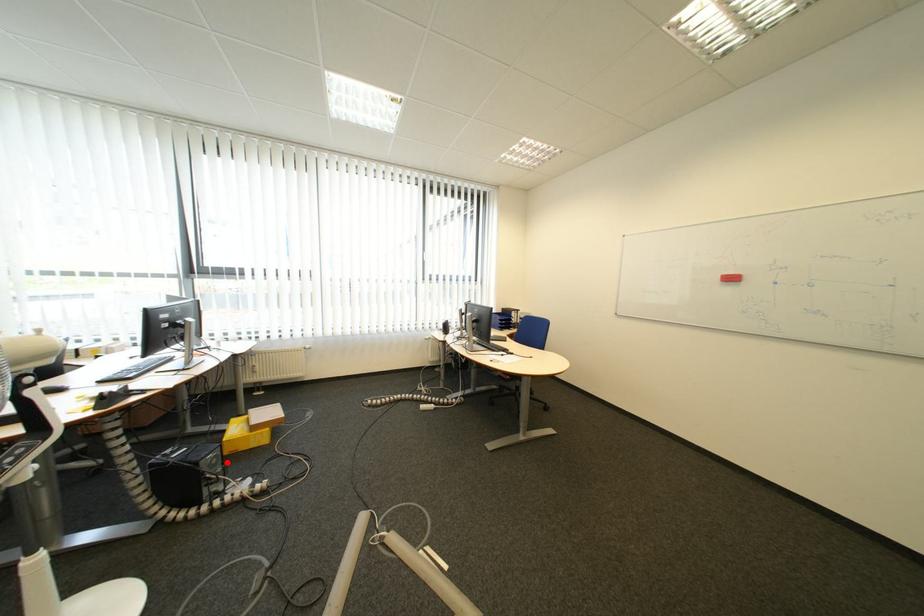
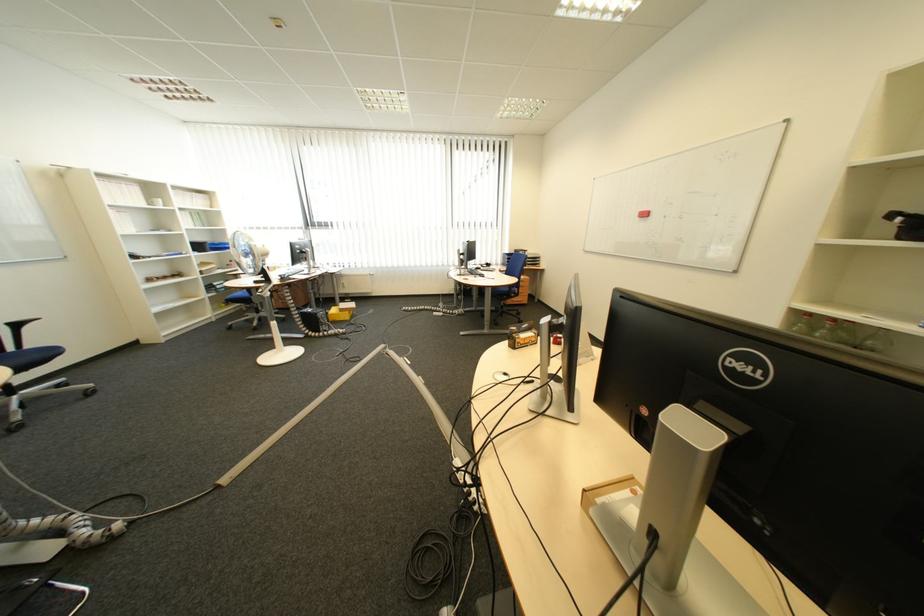
Question: I am providing you with two images of the same scene from different viewpoints. In image1, a red point is highlighted. Considering the same 3D point in image2, which of the following is correct?

Choices:
 (A) It is closer
 (B) It is farther

Answer: (A)